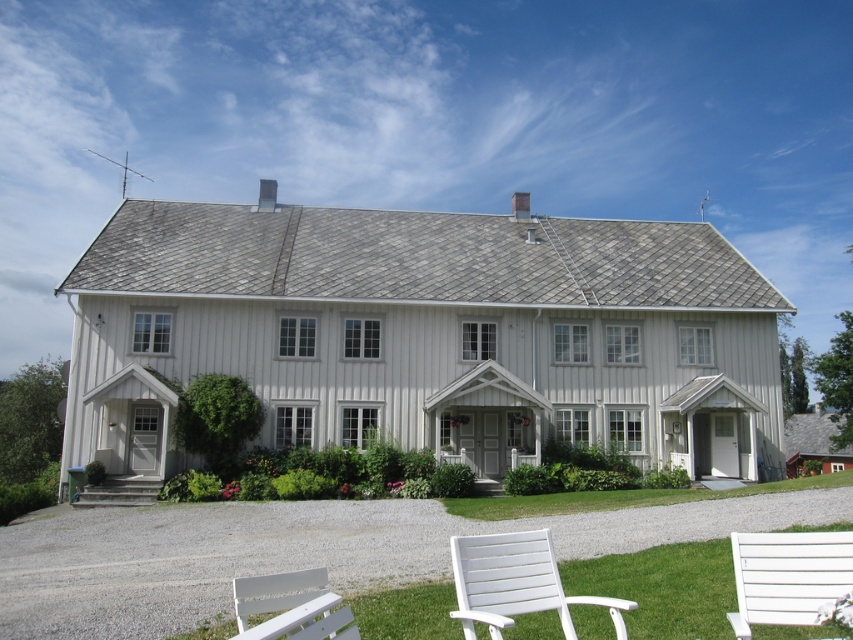
Question: Where is white plastic chair at lower center located in relation to white wooden bench at lower right in the image?

Choices:
 (A) above
 (B) below

Answer: (B)

Question: Which of the following is the farthest from the observer?

Choices:
 (A) white wood chairs at lower center
 (B) gray concrete steps at lower left

Answer: (B)

Question: Which point appears farthest from the camera in this image?

Choices:
 (A) (123, 502)
 (B) (801, 580)

Answer: (A)

Question: Which of the following is the closest to the observer?

Choices:
 (A) gray concrete steps at lower left
 (B) white painted wood bench at lower left
 (C) white wooden bench at lower right
 (D) white wood chairs at lower center

Answer: (B)

Question: In this image, where is white painted wood bench at lower left located relative to gray concrete steps at lower left?

Choices:
 (A) right
 (B) left

Answer: (A)

Question: Does white wooden bench at lower right lie behind white painted wood bench at lower left?

Choices:
 (A) no
 (B) yes

Answer: (B)